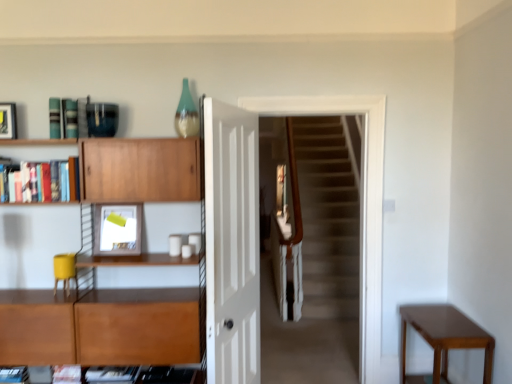
Measure the distance between point (440, 367) and camera.

The distance of point (440, 367) from camera is 2.49 meters.

What are the coordinates of `wooden bookshelf at upper left, the 2th shelf positioned from the bottom` in the screenshot? It's located at (42, 182).

The width and height of the screenshot is (512, 384). What do you see at coordinates (42, 182) in the screenshot? I see `wooden bookshelf at upper left, which is the 1th shelf in top-to-bottom order` at bounding box center [42, 182].

Measure the distance between carpeted stairs at center and camera.

The depth of carpeted stairs at center is 2.86 meters.

What do you see at coordinates (8, 121) in the screenshot?
I see `matte white picture frame at upper left, the 2th picture frame ordered from the bottom` at bounding box center [8, 121].

You are a GUI agent. You are given a task and a screenshot of the screen. Output one action in this format:
    pyautogui.click(x=<x>, y=<y>)
    Task: Click on the wooden cabinet at left, the first shelf ordered from the bottom
    This screenshot has height=384, width=512.
    Given the screenshot: What is the action you would take?
    pyautogui.click(x=142, y=170)

How many degrees apart are the facing directions of mahogany wood table at lower right and carpeted stairs at center?

87.8 degrees separate the facing orientations of mahogany wood table at lower right and carpeted stairs at center.

Is point (412, 315) more distant than point (356, 103)?

No.

Does mahogany wood table at lower right have a greater width compared to carpeted stairs at center?

A: Correct, the width of mahogany wood table at lower right exceeds that of carpeted stairs at center.

Which of these two, mahogany wood table at lower right or carpeted stairs at center, stands shorter?

mahogany wood table at lower right is shorter.

From the image's perspective, is wooden cabinet at left, the first shelf ordered from the bottom, positioned above or below mahogany wood table at lower right?

wooden cabinet at left, the first shelf ordered from the bottom, is situated higher than mahogany wood table at lower right in the image.

This screenshot has width=512, height=384. I want to click on the 1st shelf to the left of the mahogany wood table at lower right, starting your count from the anchor, so click(142, 170).

Can you tell me how much wooden cabinet at left, which is the second shelf in top-to-bottom order, and mahogany wood table at lower right differ in facing direction?

The angular difference between wooden cabinet at left, which is the second shelf in top-to-bottom order, and mahogany wood table at lower right is 88.2 degrees.

Is mahogany wood table at lower right surrounded by wooden cabinet at left, which is the second shelf in top-to-bottom order?

No, mahogany wood table at lower right is not surrounded by wooden cabinet at left, which is the second shelf in top-to-bottom order.

Considering the positions of objects white glossy door at center and wooden cabinet at left, which is the second shelf in top-to-bottom order, in the image provided, who is more to the left, white glossy door at center or wooden cabinet at left, which is the second shelf in top-to-bottom order,?

wooden cabinet at left, which is the second shelf in top-to-bottom order, is more to the left.

Is white glossy door at center far from wooden cabinet at left, the first shelf ordered from the bottom?

No, white glossy door at center is in close proximity to wooden cabinet at left, the first shelf ordered from the bottom.

Does white glossy door at center turn towards wooden cabinet at left, the first shelf ordered from the bottom?

Yes, white glossy door at center is oriented towards wooden cabinet at left, the first shelf ordered from the bottom.

Considering the sizes of objects white glossy door at center and wooden cabinet at left, the first shelf ordered from the bottom, in the image provided, who is bigger, white glossy door at center or wooden cabinet at left, the first shelf ordered from the bottom,?

wooden cabinet at left, the first shelf ordered from the bottom, is bigger.

Which is farther from the camera, (141, 216) or (215, 104)?

The point (141, 216) is more distant.

From the image's perspective, between matte white picture frame at upper left, marked as the 1th picture frame in a bottom-to-top arrangement, and white glossy door at center, who is located below?

white glossy door at center, from the image's perspective.

Is matte white picture frame at upper left, the second picture frame positioned from the left, not close to white glossy door at center?

No, matte white picture frame at upper left, the second picture frame positioned from the left, is not far away from white glossy door at center.

Considering the positions of objects matte white picture frame at upper left, the second picture frame positioned from the left, and white glossy door at center in the image provided, who is more to the right, matte white picture frame at upper left, the second picture frame positioned from the left, or white glossy door at center?

From the viewer's perspective, white glossy door at center appears more on the right side.

Considering the sizes of objects matte white picture frame at upper left, which appears as the 1th picture frame when viewed from the left, and carpeted stairs at center in the image provided, who is shorter, matte white picture frame at upper left, which appears as the 1th picture frame when viewed from the left, or carpeted stairs at center?

matte white picture frame at upper left, which appears as the 1th picture frame when viewed from the left, is shorter.

From the image's perspective, would you say matte white picture frame at upper left, which appears as the 1th picture frame when viewed from the left, is positioned over carpeted stairs at center?

Yes, from the image's perspective, matte white picture frame at upper left, which appears as the 1th picture frame when viewed from the left, is on top of carpeted stairs at center.

Can you tell me how much matte white picture frame at upper left, marked as the first picture frame in a top-to-bottom arrangement, and carpeted stairs at center differ in facing direction?

The facing directions of matte white picture frame at upper left, marked as the first picture frame in a top-to-bottom arrangement, and carpeted stairs at center are 0.829 degrees apart.

Is matte white picture frame at upper left, marked as the first picture frame in a top-to-bottom arrangement, wider than carpeted stairs at center?

Incorrect, the width of matte white picture frame at upper left, marked as the first picture frame in a top-to-bottom arrangement, does not surpass that of carpeted stairs at center.

Is point (98, 250) farther from camera compared to point (51, 163)?

That is True.

Does matte white picture frame at upper left, the second picture frame positioned from the left, come in front of wooden bookshelf at upper left, the 2th shelf positioned from the bottom?

That is False.

Considering the sizes of objects matte white picture frame at upper left, positioned as the 2th picture frame in top-to-bottom order, and wooden bookshelf at upper left, the 2th shelf positioned from the bottom, in the image provided, who is taller, matte white picture frame at upper left, positioned as the 2th picture frame in top-to-bottom order, or wooden bookshelf at upper left, the 2th shelf positioned from the bottom,?

With more height is matte white picture frame at upper left, positioned as the 2th picture frame in top-to-bottom order.

Does matte white picture frame at upper left, positioned as the 2th picture frame in top-to-bottom order, have a larger size compared to wooden bookshelf at upper left, which is the 1th shelf in top-to-bottom order?

No.

From the image's perspective, is mahogany wood table at lower right on white glossy door at center?

No, from the image's perspective, mahogany wood table at lower right is not above white glossy door at center.

Locate an element on the screen. The image size is (512, 384). table that appears behind the white glossy door at center is located at coordinates (444, 338).

Is mahogany wood table at lower right surrounding white glossy door at center?

That's incorrect, white glossy door at center is not inside mahogany wood table at lower right.

Is mahogany wood table at lower right positioned with its back to white glossy door at center?

No, mahogany wood table at lower right is not facing away from white glossy door at center.

Image resolution: width=512 pixels, height=384 pixels. Identify the location of passage that appears above the mahogany wood table at lower right (from a real-world perspective). (360, 204).

Locate an element on the screen. This screenshot has height=384, width=512. the 1st shelf to the left of the mahogany wood table at lower right, counting from the anchor's position is located at coordinates (142, 170).

From the image, which object appears to be farther from wooden bookshelf at upper left, the 2th shelf positioned from the bottom, matte white picture frame at upper left, the 2th picture frame ordered from the bottom, or matte white picture frame at upper left, marked as the 1th picture frame in a bottom-to-top arrangement?

Based on the image, matte white picture frame at upper left, the 2th picture frame ordered from the bottom, appears to be further to wooden bookshelf at upper left, the 2th shelf positioned from the bottom.

When comparing their distances from wooden bookshelf at upper left, which is the 1th shelf in top-to-bottom order, does matte white picture frame at upper left, placed as the 2th picture frame when sorted from right to left, or wooden cabinet at left, which is the second shelf in top-to-bottom order, seem closer?

matte white picture frame at upper left, placed as the 2th picture frame when sorted from right to left, is positioned closer to the anchor wooden bookshelf at upper left, which is the 1th shelf in top-to-bottom order.

Considering their positions, is matte white picture frame at upper left, placed as the 2th picture frame when sorted from right to left, positioned closer to white glossy door at center than matte white picture frame at upper left, which is counted as the first picture frame, starting from the right?

Among the two, matte white picture frame at upper left, which is counted as the first picture frame, starting from the right, is located nearer to white glossy door at center.

Looking at the image, which one is located further to white glossy door at center, matte white picture frame at upper left, the 2th picture frame ordered from the bottom, or wooden cabinet at left, the first shelf ordered from the bottom?

matte white picture frame at upper left, the 2th picture frame ordered from the bottom.

Which object lies nearer to the anchor point white glossy door at center, wooden cabinet at left, the first shelf ordered from the bottom, or wooden bookshelf at upper left, which is the 1th shelf in top-to-bottom order?

wooden cabinet at left, the first shelf ordered from the bottom.

Estimate the real-world distances between objects in this image. Which object is closer to wooden cabinet at left, the first shelf ordered from the bottom, matte white picture frame at upper left, marked as the 1th picture frame in a bottom-to-top arrangement, or carpeted stairs at center?

matte white picture frame at upper left, marked as the 1th picture frame in a bottom-to-top arrangement.

Based on their spatial positions, is matte white picture frame at upper left, marked as the first picture frame in a top-to-bottom arrangement, or matte white picture frame at upper left, positioned as the 2th picture frame in top-to-bottom order, closer to wooden cabinet at left, which is the second shelf in top-to-bottom order?

matte white picture frame at upper left, positioned as the 2th picture frame in top-to-bottom order.

Based on their spatial positions, is carpeted stairs at center or mahogany wood table at lower right closer to white glossy door at center?

carpeted stairs at center lies closer to white glossy door at center than the other object.

The width and height of the screenshot is (512, 384). Find the location of `picture frame between matte white picture frame at upper left, which appears as the 1th picture frame when viewed from the left, and wooden cabinet at left, which is the second shelf in top-to-bottom order, from top to bottom`. picture frame between matte white picture frame at upper left, which appears as the 1th picture frame when viewed from the left, and wooden cabinet at left, which is the second shelf in top-to-bottom order, from top to bottom is located at coordinates (118, 229).

I want to click on door situated between wooden cabinet at left, the first shelf ordered from the bottom, and mahogany wood table at lower right from left to right, so tap(232, 243).

The height and width of the screenshot is (384, 512). In order to click on picture frame located between wooden bookshelf at upper left, the 2th shelf positioned from the bottom, and carpeted stairs at center in the left-right direction in this screenshot , I will do `click(118, 229)`.

Identify the location of picture frame between matte white picture frame at upper left, marked as the first picture frame in a top-to-bottom arrangement, and carpeted stairs at center. This screenshot has height=384, width=512. (118, 229).